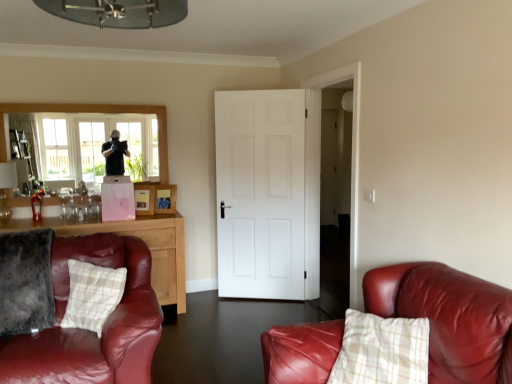
Question: Should I look upward or downward to see velvety gray pillow at lower left, marked as the 2th pillow in a right-to-left arrangement?

Choices:
 (A) down
 (B) up

Answer: (A)

Question: Should I look upward or downward to see leather couch at right?

Choices:
 (A) up
 (B) down

Answer: (B)

Question: Is clear glass window at upper left smaller than white matte door at center?

Choices:
 (A) no
 (B) yes

Answer: (B)

Question: Is clear glass window at upper left to the right of white matte door at center from the viewer's perspective?

Choices:
 (A) no
 (B) yes

Answer: (A)

Question: Does clear glass window at upper left turn towards white matte door at center?

Choices:
 (A) no
 (B) yes

Answer: (A)

Question: Does clear glass window at upper left have a larger size compared to white matte door at center?

Choices:
 (A) yes
 (B) no

Answer: (B)

Question: Does clear glass window at upper left lie in front of white matte door at center?

Choices:
 (A) yes
 (B) no

Answer: (A)

Question: Is clear glass window at upper left wider than white matte door at center?

Choices:
 (A) yes
 (B) no

Answer: (B)

Question: Is plaid fabric pillow at lower left, acting as the 1th pillow starting from the right, behind velvety gray pillow at lower left, marked as the 2th pillow in a right-to-left arrangement?

Choices:
 (A) no
 (B) yes

Answer: (B)

Question: Considering the relative sizes of plaid fabric pillow at lower left, acting as the 1th pillow starting from the right, and velvety gray pillow at lower left, marked as the 2th pillow in a right-to-left arrangement, in the image provided, is plaid fabric pillow at lower left, acting as the 1th pillow starting from the right, shorter than velvety gray pillow at lower left, marked as the 2th pillow in a right-to-left arrangement,?

Choices:
 (A) no
 (B) yes

Answer: (B)

Question: Does plaid fabric pillow at lower left, the 2th pillow from the left, have a lesser width compared to velvety gray pillow at lower left, the first pillow from the left?

Choices:
 (A) no
 (B) yes

Answer: (B)

Question: Could velvety gray pillow at lower left, marked as the 2th pillow in a right-to-left arrangement, be considered to be inside plaid fabric pillow at lower left, acting as the 1th pillow starting from the right?

Choices:
 (A) no
 (B) yes

Answer: (A)

Question: Is plaid fabric pillow at lower left, the 2th pillow from the left, facing away from velvety gray pillow at lower left, the first pillow from the left?

Choices:
 (A) no
 (B) yes

Answer: (A)

Question: Does plaid fabric pillow at lower left, the 2th pillow from the left, have a smaller size compared to velvety gray pillow at lower left, marked as the 2th pillow in a right-to-left arrangement?

Choices:
 (A) no
 (B) yes

Answer: (B)

Question: From the image's perspective, is clear glass window at upper left on top of leather couch at right?

Choices:
 (A) yes
 (B) no

Answer: (A)